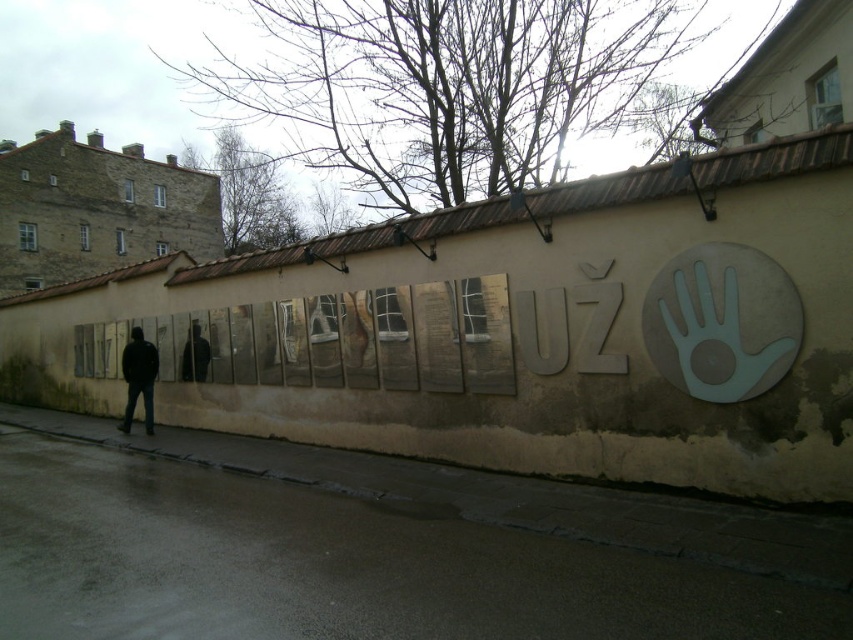
Between matte gray letters at center and dark blue jeans at left, which one appears on the left side from the viewer's perspective?

Positioned to the left is dark blue jeans at left.

Does matte gray letters at center lie in front of dark blue jeans at left?

Yes, matte gray letters at center is closer to the viewer.

I want to click on matte gray letters at center, so click(x=546, y=332).

The width and height of the screenshot is (853, 640). Identify the location of matte gray letters at center. (546, 332).

Does dark blue jeans at left have a lesser height compared to black matte jacket at center?

No.

You are a GUI agent. You are given a task and a screenshot of the screen. Output one action in this format:
    pyautogui.click(x=<x>, y=<y>)
    Task: Click on the dark blue jeans at left
    The image size is (853, 640).
    Given the screenshot: What is the action you would take?
    pyautogui.click(x=138, y=378)

The height and width of the screenshot is (640, 853). In order to click on dark blue jeans at left in this screenshot , I will do `click(138, 378)`.

Is matte gray letters at center to the right of black matte jacket at center from the viewer's perspective?

Yes, matte gray letters at center is to the right of black matte jacket at center.

Does matte gray letters at center appear under black matte jacket at center?

No, matte gray letters at center is not below black matte jacket at center.

This screenshot has width=853, height=640. In order to click on matte gray letters at center in this screenshot , I will do `click(546, 332)`.

Where is `matte gray letters at center`? The image size is (853, 640). matte gray letters at center is located at coordinates (546, 332).